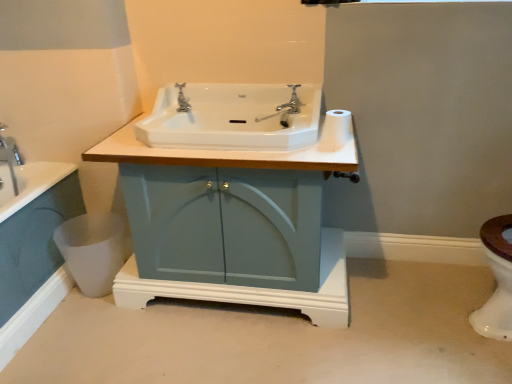
You are a GUI agent. You are given a task and a screenshot of the screen. Output one action in this format:
    pyautogui.click(x=<x>, y=<y>)
    Task: Click on the vacant space in front of matte blue cabinet at center
    The width and height of the screenshot is (512, 384).
    Given the screenshot: What is the action you would take?
    pyautogui.click(x=243, y=348)